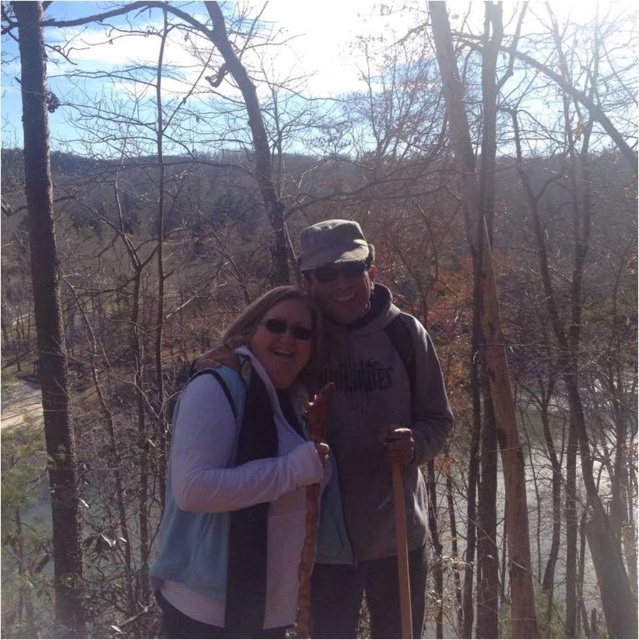
Question: In this image, where is blue fabric vest at center located relative to gray matte jacket at center?

Choices:
 (A) left
 (B) right

Answer: (A)

Question: Which of these objects is positioned closest to the gray matte jacket at center?

Choices:
 (A) blue fabric vest at center
 (B) matte black goggles at center

Answer: (A)

Question: Which point is farther to the camera?

Choices:
 (A) (380, 340)
 (B) (316, 268)
 (C) (203, 616)

Answer: (A)

Question: Which of the following is the farthest from the observer?

Choices:
 (A) (328, 268)
 (B) (334, 422)

Answer: (B)

Question: Is blue fabric vest at center further to camera compared to matte black goggles at center?

Choices:
 (A) yes
 (B) no

Answer: (B)

Question: Where is blue fabric vest at center located in relation to matte black goggles at center in the image?

Choices:
 (A) right
 (B) left

Answer: (B)